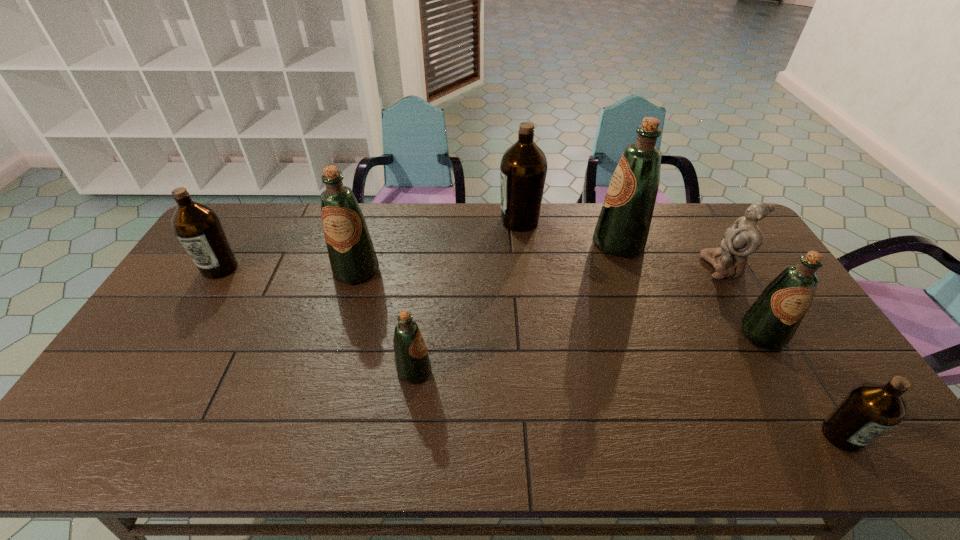
Find the location of `figurine`. figurine is located at coordinates tap(744, 237).

In order to click on the smallest green olive oil in this screenshot , I will do `click(412, 362)`.

You are a GUI agent. You are given a task and a screenshot of the screen. Output one action in this format:
    pyautogui.click(x=<x>, y=<y>)
    Task: Click on the third object from left to right
    The image size is (960, 540).
    Given the screenshot: What is the action you would take?
    pyautogui.click(x=412, y=362)

The image size is (960, 540). In order to click on the nearest brown olive oil in this screenshot , I will do `click(870, 409)`.

This screenshot has width=960, height=540. I want to click on the smallest brown olive oil, so click(870, 409).

In order to click on vacant region located on the front-facing side of the third green olive oil from left to right in this screenshot , I will do `click(517, 244)`.

You are a GUI agent. You are given a task and a screenshot of the screen. Output one action in this format:
    pyautogui.click(x=<x>, y=<y>)
    Task: Click on the vacant area located 0.190m on the front-facing side of the third green olive oil from left to right
    This screenshot has width=960, height=540.
    Given the screenshot: What is the action you would take?
    [538, 244]

The image size is (960, 540). Identify the location of blank area located 0.150m on the front-facing side of the third green olive oil from left to right. (548, 244).

You are a GUI agent. You are given a task and a screenshot of the screen. Output one action in this format:
    pyautogui.click(x=<x>, y=<y>)
    Task: Click on the vacant space located 0.200m on the label of the fourth olive oil from right to left
    The height and width of the screenshot is (540, 960).
    Given the screenshot: What is the action you would take?
    pyautogui.click(x=444, y=221)

This screenshot has height=540, width=960. I want to click on free point located on the label of the fourth olive oil from right to left, so click(404, 221).